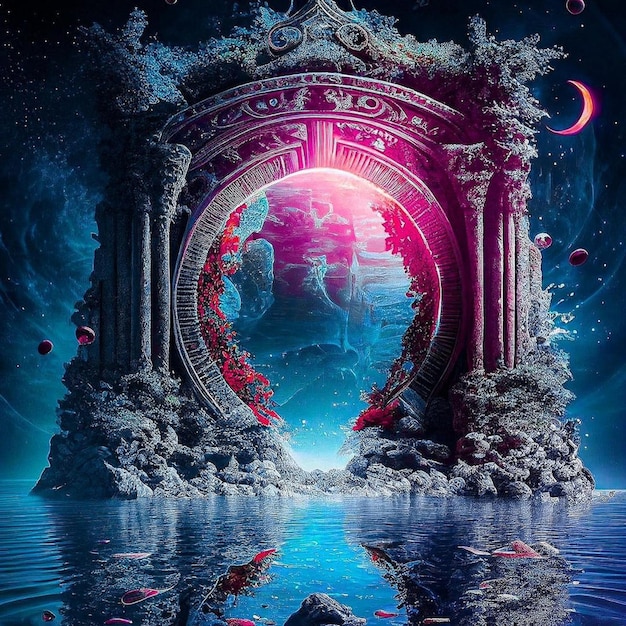
Image resolution: width=626 pixels, height=626 pixels. In order to click on pillar to the right of arch in this screenshot , I will do `click(503, 283)`.